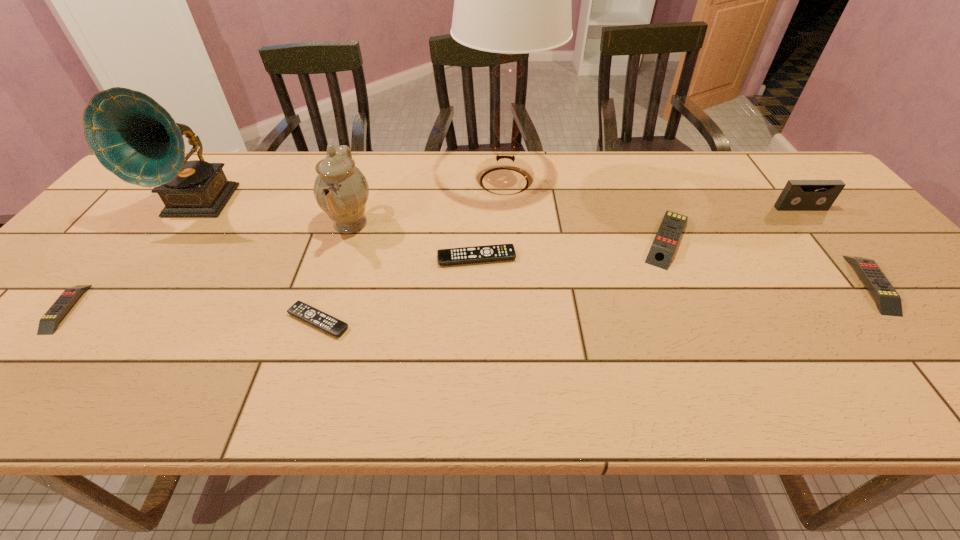
The image size is (960, 540). Identify the location of the tallest object. (510, 0).

Image resolution: width=960 pixels, height=540 pixels. I want to click on phonograph_record, so pos(135,138).

Identify the location of chinaware. (341, 190).

Where is `the fourth tallest object`? The width and height of the screenshot is (960, 540). the fourth tallest object is located at coordinates (798, 195).

You are a GUI agent. You are given a task and a screenshot of the screen. Output one action in this format:
    pyautogui.click(x=<x>, y=<y>)
    Task: Click on the second remote control from right to left
    This screenshot has width=960, height=540.
    Given the screenshot: What is the action you would take?
    pyautogui.click(x=667, y=237)

Find the location of a particular element. the second yellow remote control from right to left is located at coordinates (667, 237).

At what (x,y) coordinates should I click in order to perform the action: click on the fourth shortest remote control. Please return your answer as a coordinate pair (x, y). The height and width of the screenshot is (540, 960). Looking at the image, I should click on (888, 301).

Where is `the sixth tallest object`? This screenshot has height=540, width=960. the sixth tallest object is located at coordinates (888, 301).

Identify the location of the leftmost yellow remote control. The width and height of the screenshot is (960, 540). (48, 324).

Image resolution: width=960 pixels, height=540 pixels. I want to click on the smallest yellow remote control, so click(x=48, y=324).